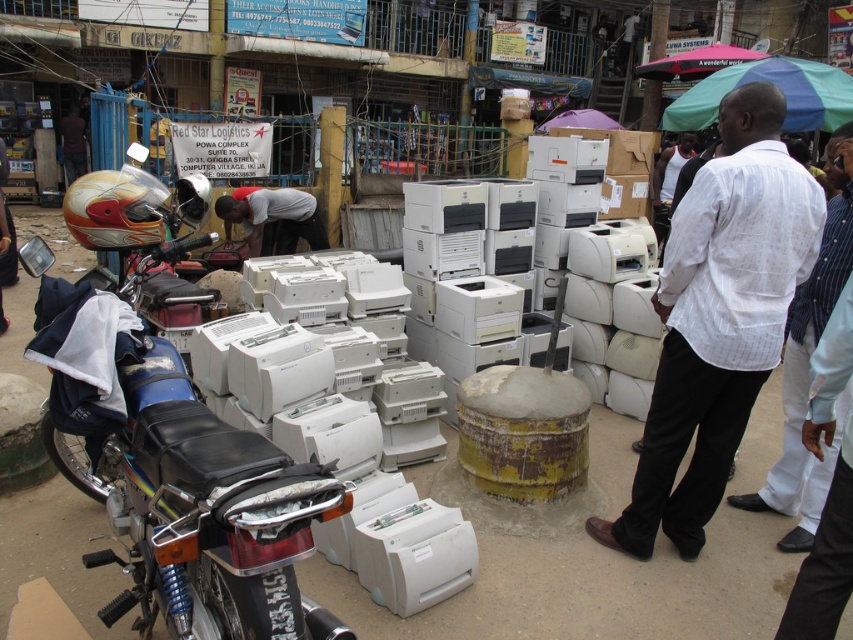
Question: Can you confirm if white cotton shirt at center is positioned above white striped shirt at center?

Choices:
 (A) yes
 (B) no

Answer: (A)

Question: Which point is closer to the camera?

Choices:
 (A) (677, 448)
 (B) (851, 403)
 (C) (80, 198)

Answer: (B)

Question: Which point appears farthest from the camera in this image?

Choices:
 (A) (250, 253)
 (B) (722, 205)
 (C) (294, 529)

Answer: (A)

Question: Among these points, which one is nearest to the camera?

Choices:
 (A) (773, 193)
 (B) (799, 397)
 (C) (93, 557)

Answer: (C)

Question: Is shiny chrome motorcycle at left above white striped shirt at center?

Choices:
 (A) no
 (B) yes

Answer: (A)

Question: Is white striped shirt at center positioned at the back of dark gray fabric shirt at center?

Choices:
 (A) no
 (B) yes

Answer: (A)